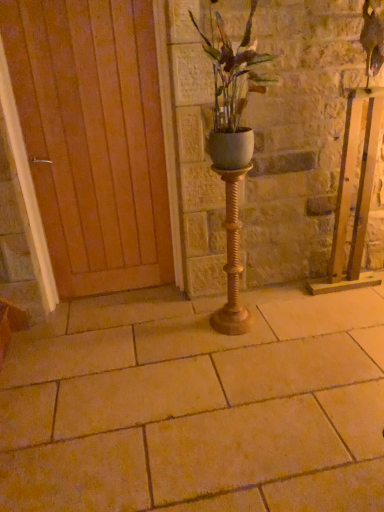
Image resolution: width=384 pixels, height=512 pixels. Find the location of `vacant space behind gold textured candle holder at center`. vacant space behind gold textured candle holder at center is located at coordinates (239, 306).